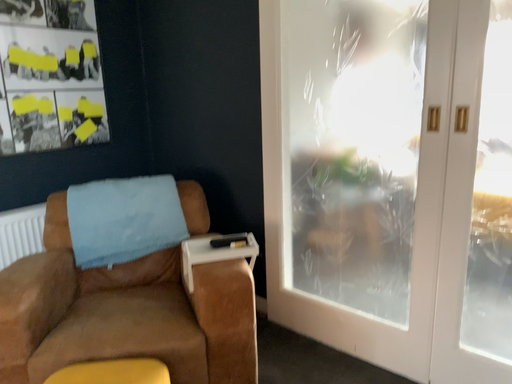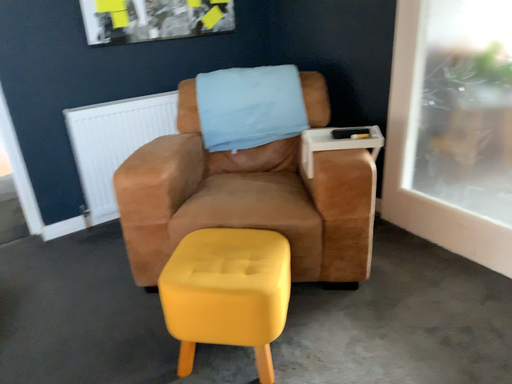
Question: Which way did the camera rotate in the video?

Choices:
 (A) rotated upward
 (B) rotated downward

Answer: (B)